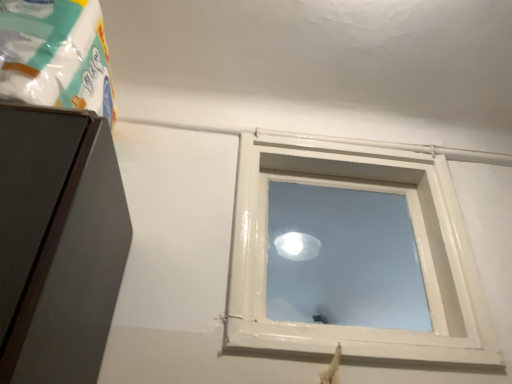
Based on the photo, what is the approximate height of white glossy window at center?

It is 24.87 inches.

Describe the element at coordinates (416, 242) in the screenshot. I see `white glossy window at center` at that location.

Locate an element on the screen. This screenshot has height=384, width=512. white glossy window at center is located at coordinates (416, 242).

The height and width of the screenshot is (384, 512). In order to click on white glossy window at center in this screenshot , I will do `click(416, 242)`.